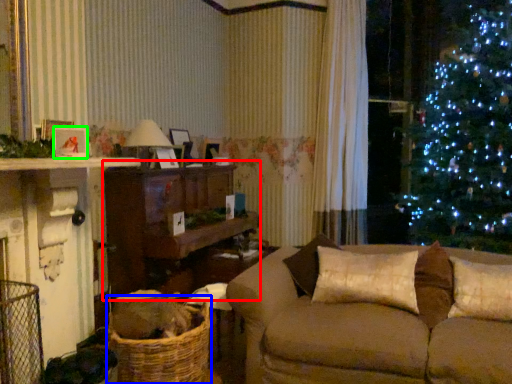
Question: Which object is positioned farthest from entertainment center (highlighted by a red box)? Select from basket (highlighted by a blue box) and picture frame (highlighted by a green box).

Choices:
 (A) basket
 (B) picture frame

Answer: (B)